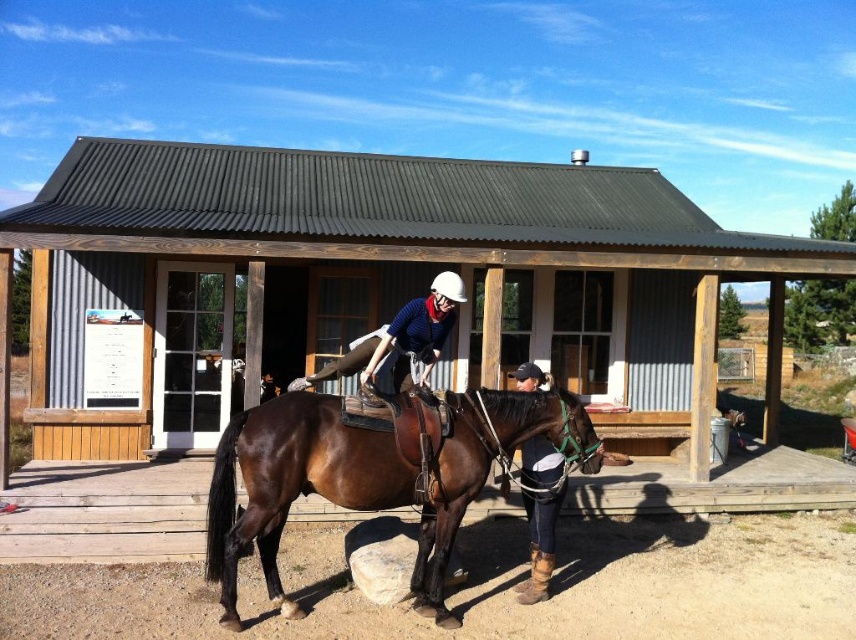
Which of these two, brown leather horse at center or brown leather boots at lower center, stands shorter?

brown leather boots at lower center

Does brown leather horse at center appear on the right side of brown leather boots at lower center?

No, brown leather horse at center is not to the right of brown leather boots at lower center.

Does point (375, 490) lie in front of point (533, 470)?

Yes, it is.

Where is `brown leather horse at center`? The image size is (856, 640). brown leather horse at center is located at coordinates (373, 474).